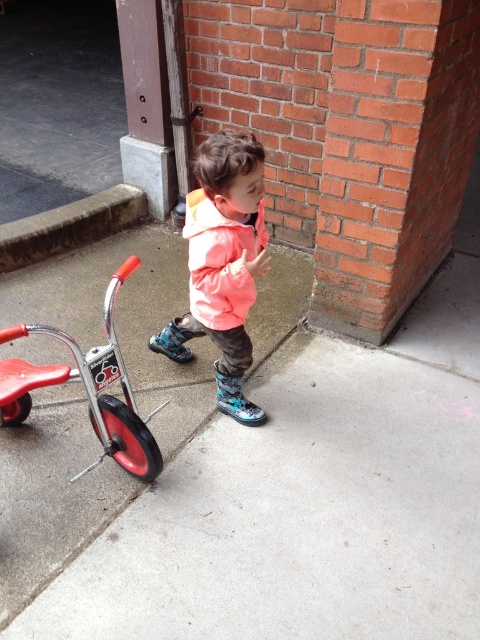
Question: Which point appears closest to the camera in this image?

Choices:
 (A) (44, 387)
 (B) (265, 230)

Answer: (A)

Question: Can you confirm if matte orange jacket at center is positioned to the right of metallic red tricycle at left?

Choices:
 (A) yes
 (B) no

Answer: (A)

Question: Which of the following is the farthest from the observer?

Choices:
 (A) (122, 392)
 (B) (195, 193)

Answer: (A)

Question: Is matte orange jacket at center above metallic red tricycle at left?

Choices:
 (A) yes
 (B) no

Answer: (A)

Question: Does matte orange jacket at center appear on the left side of metallic red tricycle at left?

Choices:
 (A) no
 (B) yes

Answer: (A)

Question: Which object is farther from the camera taking this photo?

Choices:
 (A) matte orange jacket at center
 (B) metallic red tricycle at left

Answer: (A)